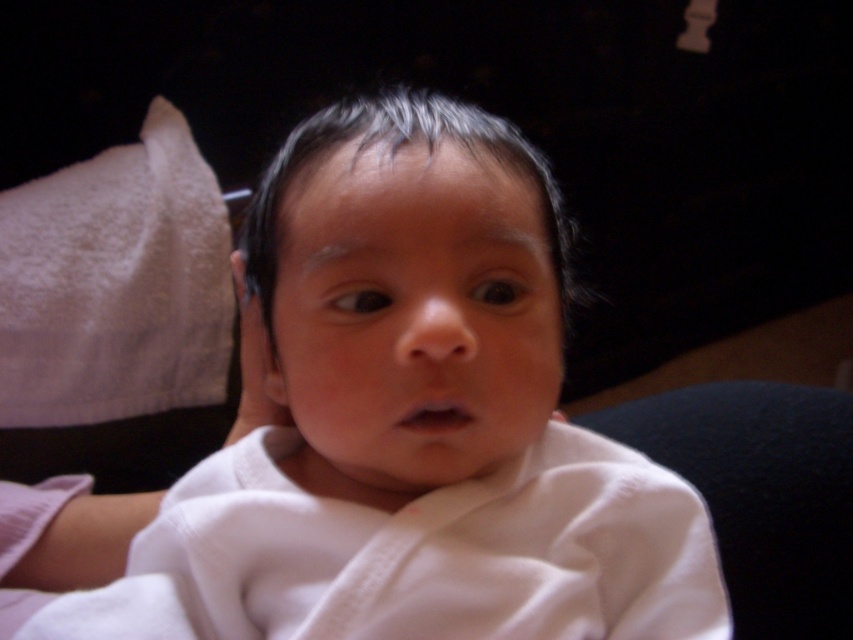
In order to click on white soft cloth at center in this screenshot , I will do `click(412, 420)`.